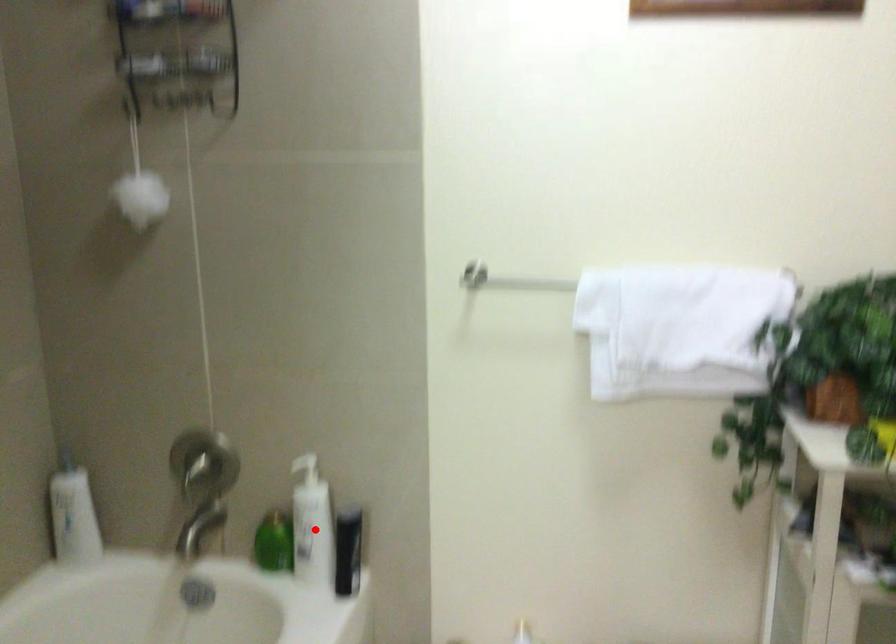
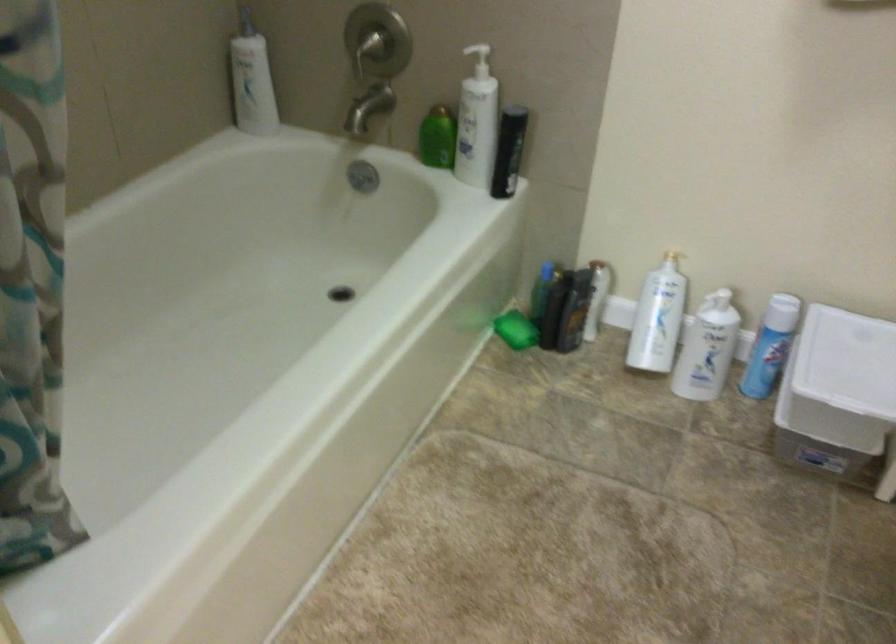
The point at the highlighted location is marked in the first image. Where is the corresponding point in the second image?

(477, 122)